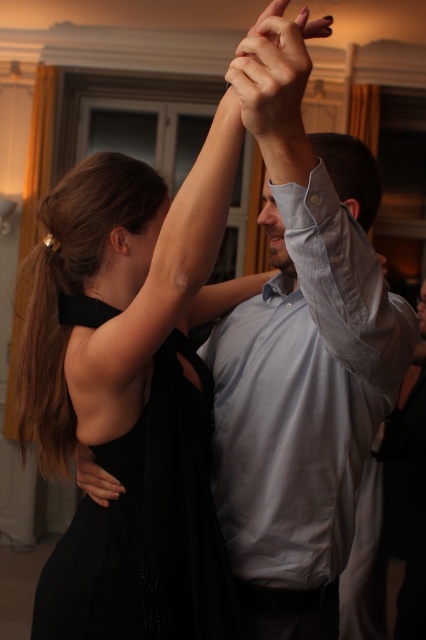
You are a photographer capturing this dance scene. You need to ensure both the black satin dress at center and the matte skin at upper center are in focus. Which object should you adjust your camera focus to prioritize based on their sizes?

The black satin dress at center is larger than the matte skin at upper center, so you should prioritize focusing on the black satin dress at center to ensure it is in focus.

What is the object located at the coordinates point [275,76]?

The point [275,76] indicates matte skin at upper center.

You are a photographer standing 2 meters away from the couple. You want to take a photo of the point at coordinates point (131, 577). Will you need to adjust your camera focus to capture this point clearly?

The distance of point (131, 577) from camera is 1.36 meters, which is closer than your current position of 2 meters. To focus on this point, you need to adjust the camera focus to the shorter distance of 1.36 meters.